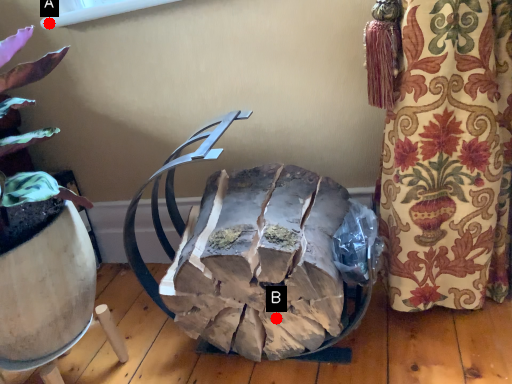
Question: Two points are circled on the image, labeled by A and B beside each circle. Which point appears closest to the camera in this image?

Choices:
 (A) A is closer
 (B) B is closer

Answer: (B)